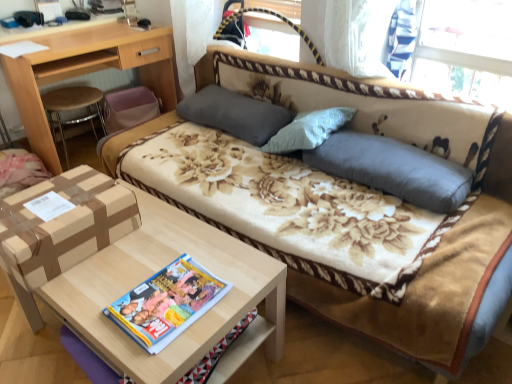
Question: In terms of width, does gray fabric pillow at center, the second pillow positioned from the back, look wider or thinner when compared to gray fabric pillow at center, which appears as the second pillow when viewed from the front?

Choices:
 (A) thin
 (B) wide

Answer: (B)

Question: In the image, is gray fabric pillow at center, marked as the first pillow in a right-to-left arrangement, positioned in front of or behind gray fabric pillow at center, which appears as the first pillow when viewed from the back?

Choices:
 (A) behind
 (B) front

Answer: (B)

Question: Considering the real-world distances, which object is farthest from the light brown wood desk at upper left?

Choices:
 (A) multicolored glossy magazine at center
 (B) gray fabric pillow at center, which appears as the second pillow when viewed from the front
 (C) light brown wood table at lower left
 (D) gray fabric pillow at center, the second pillow in the left-to-right sequence
 (E) floral fabric studio couch at center

Answer: (E)

Question: Which object is the farthest from the gray fabric pillow at center, marked as the 2th pillow in a right-to-left arrangement?

Choices:
 (A) multicolored glossy magazine at center
 (B) brown cardboard box at lower left
 (C) light brown wood table at lower left
 (D) light brown wood desk at upper left
 (E) gray fabric pillow at center, marked as the first pillow in a right-to-left arrangement

Answer: (A)